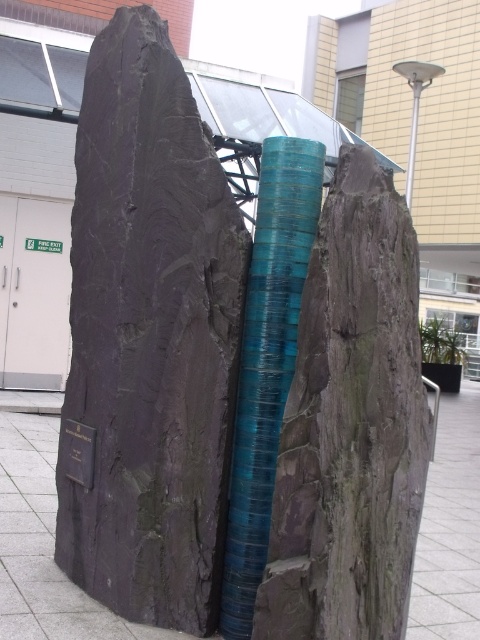
You are an artist planning to sketch the sculpture. You want to ensure the relative positions of the rough stone boulder at center and the teal glossy tube at center are accurate. Which object should be drawn to the right side of the other?

The rough stone boulder at center is to the right of the teal glossy tube at center, so in your sketch, the rough stone boulder at center should be placed to the right of the teal glossy tube at center.

You are an artist planning to sketch this sculpture. You want to ensure the positioning of the teal glossy tube at center and the metallic pole at upper right is accurate. Which object is positioned to the left when viewed from the front?

The teal glossy tube at center is positioned to the left of the metallic pole at upper right when viewed from the front.